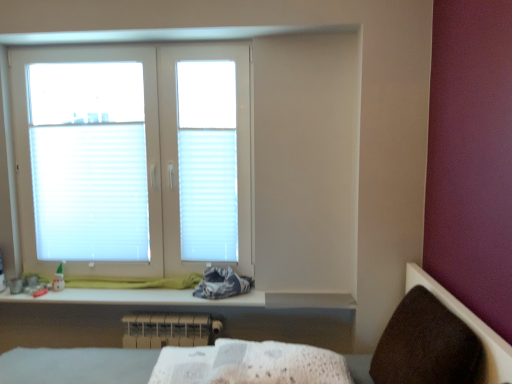
Question: Does white plastic window at upper left come in front of white textured fabric at lower center?

Choices:
 (A) yes
 (B) no

Answer: (B)

Question: Considering the relative positions of white plastic window at upper left and white textured fabric at lower center in the image provided, is white plastic window at upper left to the right of white textured fabric at lower center from the viewer's perspective?

Choices:
 (A) no
 (B) yes

Answer: (A)

Question: Considering the relative sizes of white plastic window at upper left and white textured fabric at lower center in the image provided, is white plastic window at upper left bigger than white textured fabric at lower center?

Choices:
 (A) no
 (B) yes

Answer: (B)

Question: From a real-world perspective, is white plastic window at upper left physically below white textured fabric at lower center?

Choices:
 (A) yes
 (B) no

Answer: (B)

Question: Can you confirm if white plastic window at upper left is thinner than white textured fabric at lower center?

Choices:
 (A) no
 (B) yes

Answer: (B)

Question: Is white plastic window at upper left directly adjacent to white textured fabric at lower center?

Choices:
 (A) no
 (B) yes

Answer: (A)

Question: Is brown fabric armchair at lower right with white textured fabric at lower center?

Choices:
 (A) no
 (B) yes

Answer: (A)

Question: Does brown fabric armchair at lower right contain white textured fabric at lower center?

Choices:
 (A) yes
 (B) no

Answer: (B)

Question: Does brown fabric armchair at lower right have a greater height compared to white textured fabric at lower center?

Choices:
 (A) yes
 (B) no

Answer: (A)

Question: Is brown fabric armchair at lower right shorter than white textured fabric at lower center?

Choices:
 (A) yes
 (B) no

Answer: (B)

Question: Considering the relative positions of brown fabric armchair at lower right and white textured fabric at lower center in the image provided, is brown fabric armchair at lower right to the right of white textured fabric at lower center from the viewer's perspective?

Choices:
 (A) yes
 (B) no

Answer: (A)

Question: Can you confirm if brown fabric armchair at lower right is wider than white textured fabric at lower center?

Choices:
 (A) yes
 (B) no

Answer: (B)

Question: From the image's perspective, is white textured fabric at lower center below white pleated blind at upper left, acting as the 1th blind starting from the left?

Choices:
 (A) no
 (B) yes

Answer: (B)